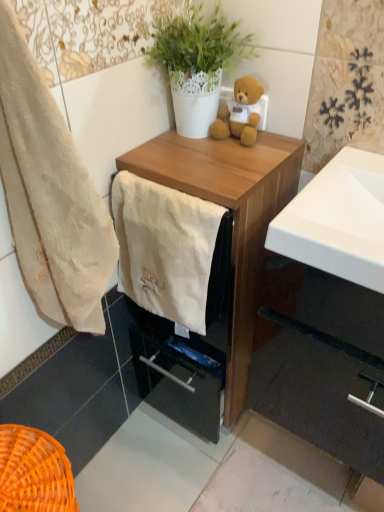
At what (x,y) coordinates should I click in order to perform the action: click on vacant area situated to the left side of soft plush teddy bear at upper center. Please return your answer as a coordinate pair (x, y). Looking at the image, I should click on (172, 148).